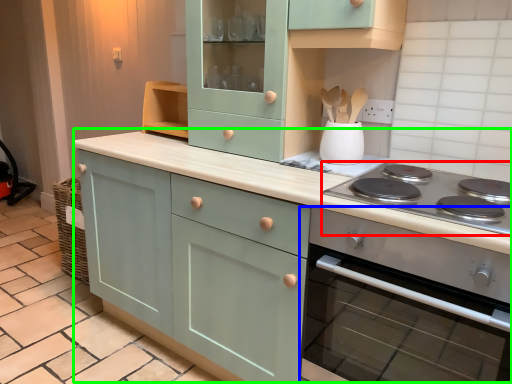
Question: Which is nearer to the gas stove (highlighted by a red box)? home appliance (highlighted by a blue box) or cabinetry (highlighted by a green box).

Choices:
 (A) home appliance
 (B) cabinetry

Answer: (A)